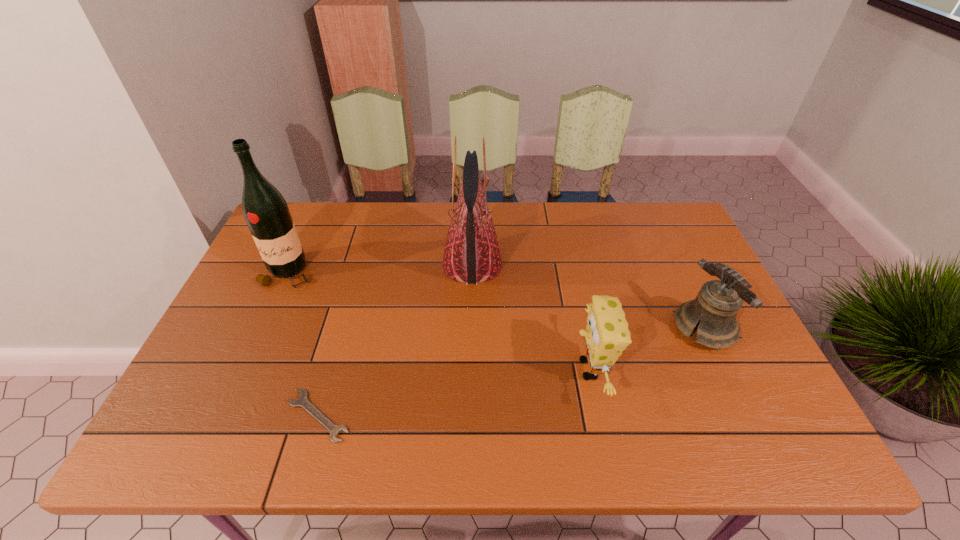
Locate an element on the screen. vacant space in between the third object from right to left and the sponge is located at coordinates (531, 317).

Locate an element on the screen. This screenshot has width=960, height=540. free area in between the wine bottle and the rightmost object is located at coordinates (496, 300).

Where is `empty location between the leftmost object and the third object from left to right`? empty location between the leftmost object and the third object from left to right is located at coordinates (380, 269).

In order to click on vacant space in between the rightmost object and the wrench in this screenshot , I will do `click(511, 372)`.

Where is `vacant area between the second object from right to left and the handbag`? vacant area between the second object from right to left and the handbag is located at coordinates (531, 317).

You are a GUI agent. You are given a task and a screenshot of the screen. Output one action in this format:
    pyautogui.click(x=<x>, y=<y>)
    Task: Click on the object that is the third closest to the fourth object from left to right
    This screenshot has height=540, width=960.
    Given the screenshot: What is the action you would take?
    pos(302,401)

I want to click on the second closest object to the fourth object from left to right, so 718,302.

At what (x,y) coordinates should I click in order to perform the action: click on vacant point that satisfies the following two spatial constraints: 1. on the back side of the bell; 2. on the right side of the wrench. Please return your answer as a coordinate pair (x, y). The image size is (960, 540). Looking at the image, I should click on (343, 328).

This screenshot has height=540, width=960. I want to click on free space in the image that satisfies the following two spatial constraints: 1. on the front side of the bell; 2. on the left side of the handbag, so click(471, 328).

What are the coordinates of `vacant region that satisfies the following two spatial constraints: 1. on the front side of the rightmost object; 2. on the face of the sponge` in the screenshot? It's located at (724, 369).